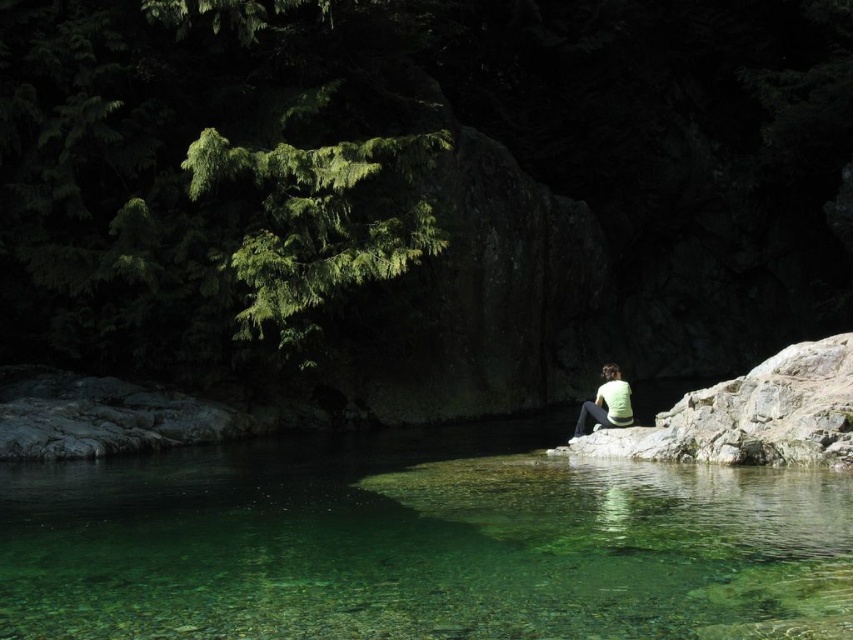
Question: Which of the following is the closest to the observer?

Choices:
 (A) (577, 528)
 (B) (598, 412)

Answer: (A)

Question: Can you confirm if clear glassy water at center is positioned to the left of green matte shirt at center?

Choices:
 (A) no
 (B) yes

Answer: (B)

Question: Which of the following is the farthest from the observer?

Choices:
 (A) (x=172, y=528)
 (B) (x=616, y=422)

Answer: (B)

Question: Considering the relative positions of clear glassy water at center and green matte shirt at center in the image provided, where is clear glassy water at center located with respect to green matte shirt at center?

Choices:
 (A) left
 (B) right

Answer: (A)

Question: Does clear glassy water at center have a smaller size compared to green matte shirt at center?

Choices:
 (A) no
 (B) yes

Answer: (B)